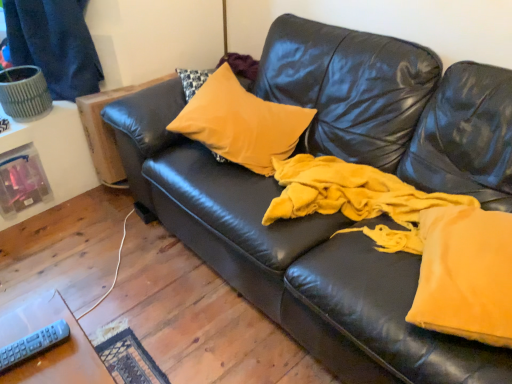
Question: From a real-world perspective, does dark blue fabric at upper left stand above gray plastic remote at lower left?

Choices:
 (A) yes
 (B) no

Answer: (A)

Question: Does dark blue fabric at upper left have a lesser height compared to gray plastic remote at lower left?

Choices:
 (A) no
 (B) yes

Answer: (A)

Question: Is dark blue fabric at upper left to the right of gray plastic remote at lower left from the viewer's perspective?

Choices:
 (A) no
 (B) yes

Answer: (A)

Question: From the image's perspective, is dark blue fabric at upper left below gray plastic remote at lower left?

Choices:
 (A) yes
 (B) no

Answer: (B)

Question: Is dark blue fabric at upper left wider than gray plastic remote at lower left?

Choices:
 (A) yes
 (B) no

Answer: (A)

Question: From a real-world perspective, is gray plastic remote at lower left physically located above or below velvet yellow blanket at center, placed as the first fabric when sorted from back to front?

Choices:
 (A) above
 (B) below

Answer: (A)

Question: Relative to velvet yellow blanket at center, which appears as the 2th fabric when viewed from the front, is gray plastic remote at lower left in front or behind?

Choices:
 (A) front
 (B) behind

Answer: (A)

Question: Do you think gray plastic remote at lower left is within velvet yellow blanket at center, which appears as the 2th fabric when viewed from the front, or outside of it?

Choices:
 (A) outside
 (B) inside

Answer: (A)

Question: From the image's perspective, is gray plastic remote at lower left located above or below velvet yellow blanket at center, which appears as the 2th fabric when viewed from the front?

Choices:
 (A) above
 (B) below

Answer: (B)

Question: Choose the correct answer: Is velvet yellow blanket at center, which appears as the 2th fabric when viewed from the front, inside velvet yellow pillow at right, the first fabric in the front-to-back sequence, or outside it?

Choices:
 (A) inside
 (B) outside

Answer: (B)

Question: Is point (370, 205) closer or farther from the camera than point (412, 311)?

Choices:
 (A) closer
 (B) farther

Answer: (B)

Question: Is velvet yellow blanket at center, placed as the first fabric when sorted from back to front, in front of or behind velvet yellow pillow at right, the first fabric in the front-to-back sequence, in the image?

Choices:
 (A) front
 (B) behind

Answer: (B)

Question: From the image's perspective, relative to velvet yellow pillow at right, placed as the second fabric when sorted from back to front, is velvet yellow blanket at center, placed as the first fabric when sorted from back to front, above or below?

Choices:
 (A) above
 (B) below

Answer: (A)

Question: Considering the positions of velvet yellow blanket at center, which appears as the 2th fabric when viewed from the front, and satin yellow pillow at center in the image, is velvet yellow blanket at center, which appears as the 2th fabric when viewed from the front, taller or shorter than satin yellow pillow at center?

Choices:
 (A) tall
 (B) short

Answer: (B)

Question: Is velvet yellow blanket at center, which appears as the 2th fabric when viewed from the front, in front of or behind satin yellow pillow at center in the image?

Choices:
 (A) behind
 (B) front

Answer: (B)